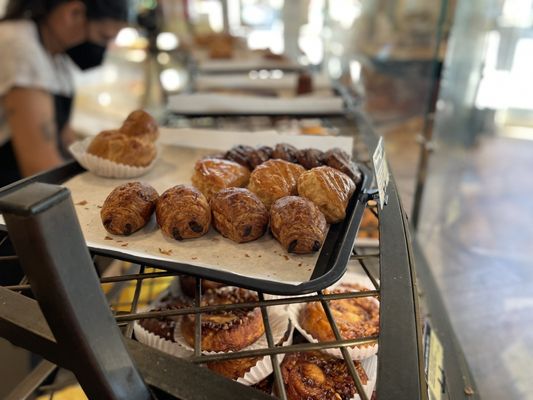
Identify the location of window. (401, 366), (399, 248), (495, 378), (454, 286), (432, 236).